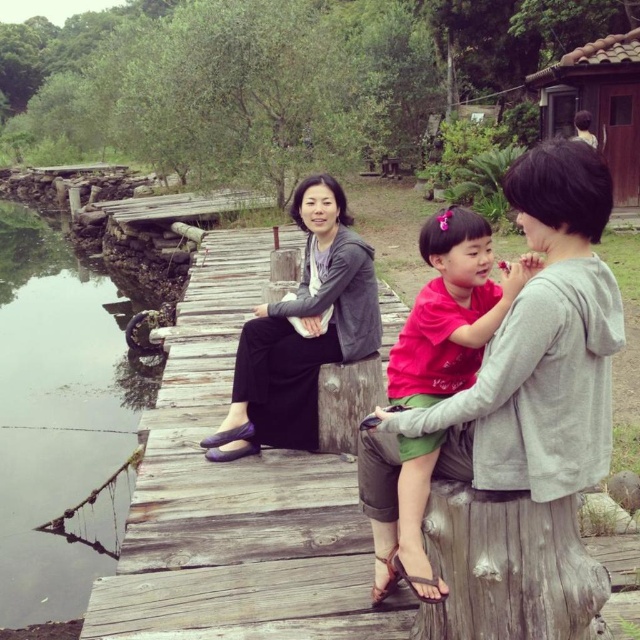
You are a photographer trying to capture two people sitting on a dock. You notice a matte gray sweater at center and a matte pink shirt at center. Which person should you focus on first if you want to photograph them from left to right?

You should focus on the matte gray sweater at center first because it is positioned on the left side of the matte pink shirt at center, so when moving from left to right, the matte gray sweater at center comes first.

You are a photographer trying to capture a candid shot of the matte gray sweater at center and the matte pink shirt at center. Since you want to ensure both are in focus, which one should you focus on first to make sure the depth of field includes both?

You should focus on the matte gray sweater at center first because the matte pink shirt at center is behind it, so by focusing on the closer object, the depth of field will extend backward to include the matte pink shirt at center.

You are standing on the dock and want to place a small potted plant between the two points, point (596, 163) and point (332, 362). Which point should you start from to ensure the plant is closer to the camera?

You should start from point (596, 163) because it is closer to the camera than point (332, 362).